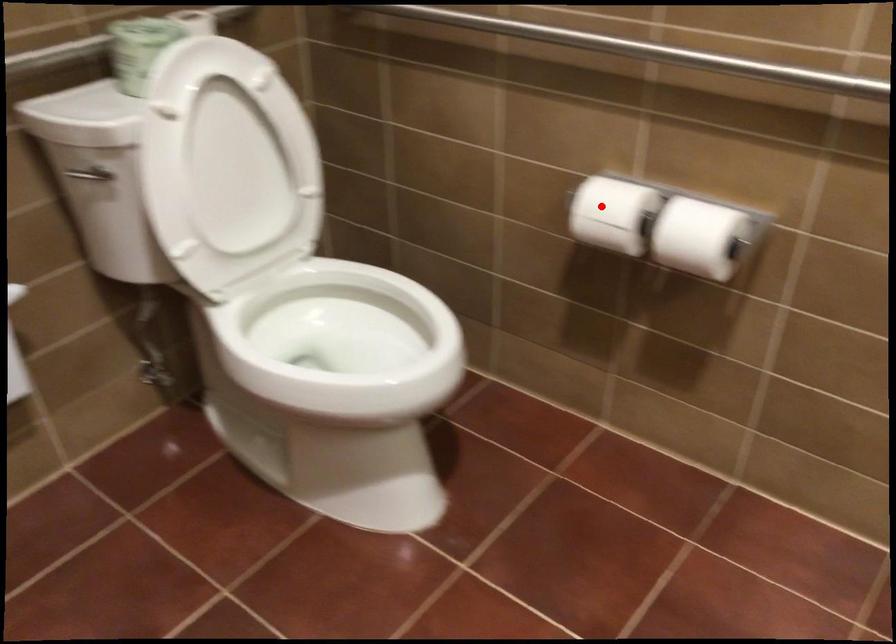
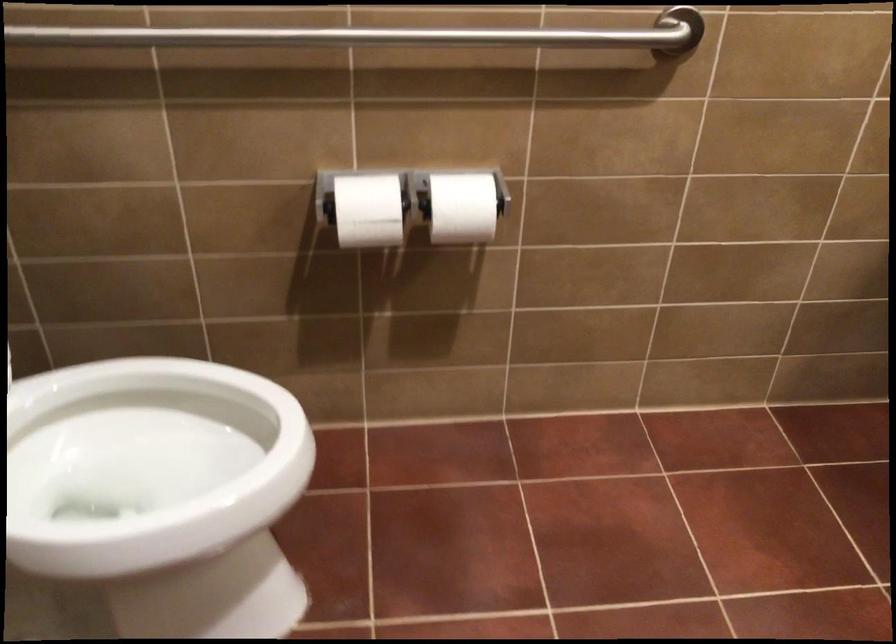
The point at the highlighted location is marked in the first image. Where is the corresponding point in the second image?

(367, 210)